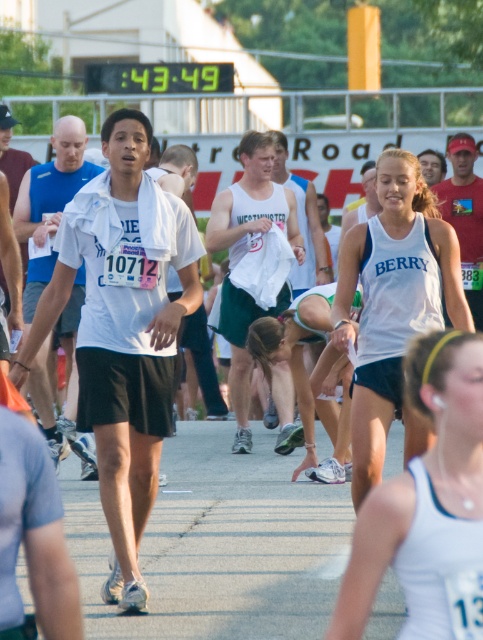
Question: Which of the following is the farthest from the observer?

Choices:
 (A) (365, 577)
 (B) (64, 221)

Answer: (B)

Question: From the image, what is the correct spatial relationship of white matte shirt at center in relation to white tank top at center?

Choices:
 (A) right
 (B) left

Answer: (B)

Question: Can you confirm if white matte shirt at center is positioned to the right of white tank top at center?

Choices:
 (A) yes
 (B) no

Answer: (B)

Question: Among these points, which one is nearest to the camera?

Choices:
 (A) (165, 417)
 (B) (384, 488)

Answer: (B)

Question: From the image, what is the correct spatial relationship of white matte shirt at center in relation to white tank top at center?

Choices:
 (A) right
 (B) left

Answer: (B)